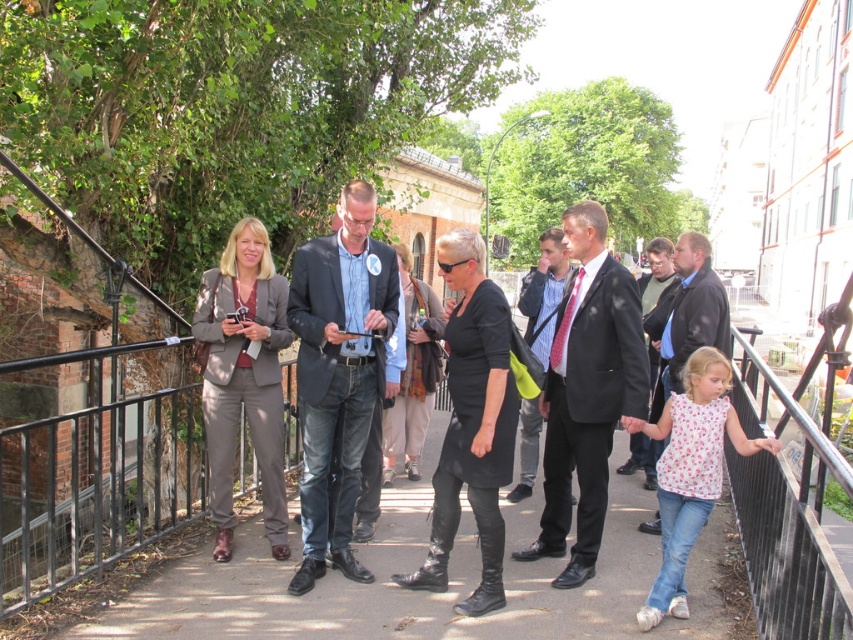
Question: Does black leather dress at center lie in front of dark gray suit at center?

Choices:
 (A) yes
 (B) no

Answer: (A)

Question: Is black leather jacket at center below black leather boots at center?

Choices:
 (A) yes
 (B) no

Answer: (B)

Question: Which object appears closest to the camera in this image?

Choices:
 (A) matte black suit at center
 (B) dark gray suit at center
 (C) black leather dress at center
 (D) white floral blouse at lower right

Answer: (D)

Question: Based on their relative distances, which object is farther from the black leather boots at center?

Choices:
 (A) black suit at center
 (B) white floral blouse at lower right

Answer: (A)

Question: Estimate the real-world distances between objects in this image. Which object is closer to the dark blue suit at center?

Choices:
 (A) black suit at center
 (B) black leather boots at center
 (C) matte black suit at center

Answer: (B)

Question: Observing the image, what is the correct spatial positioning of black leather jacket at center in reference to matte black suit at center?

Choices:
 (A) right
 (B) left

Answer: (B)